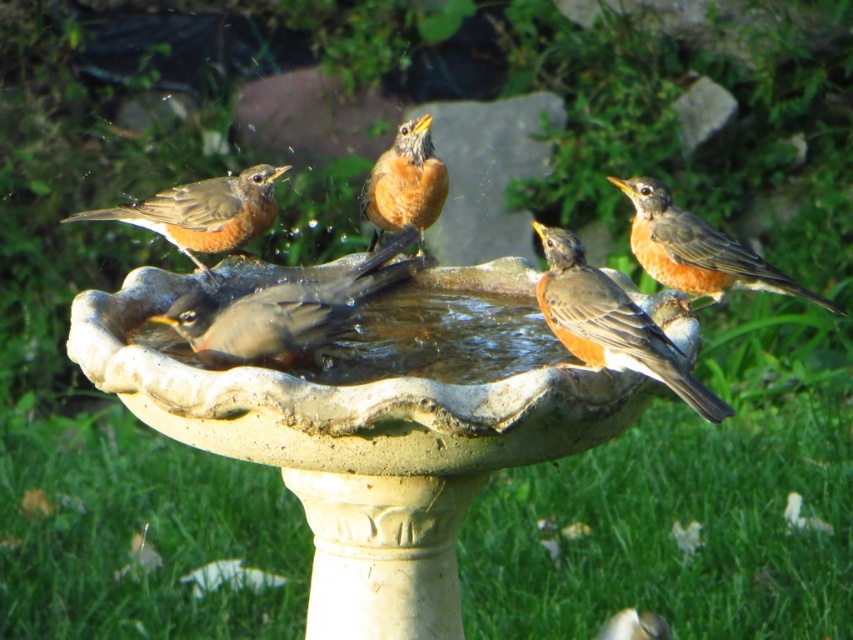
Between point (709, 282) and point (227, 193), which one is positioned in front?

Positioned in front is point (709, 282).

Between brown matte bird at right and brown matte bird at left, which one appears on the right side from the viewer's perspective?

From the viewer's perspective, brown matte bird at right appears more on the right side.

Who is more forward, [654,272] or [236,240]?

Positioned in front is point [236,240].

Locate an element on the screen. The height and width of the screenshot is (640, 853). brown matte bird at right is located at coordinates (695, 250).

Measure the distance between brown matte bird at center and camera.

A distance of 7.25 feet exists between brown matte bird at center and camera.

Does brown matte bird at center lie in front of brown matte bird at left?

Yes, it is.

Between point (339, 332) and point (236, 253), which one is positioned in front?

Point (339, 332) is in front.

Locate an element on the screen. The height and width of the screenshot is (640, 853). brown matte bird at center is located at coordinates (281, 314).

Which of these two, brown matte bird at center or bright orange bird at center, stands taller?

Standing taller between the two is bright orange bird at center.

Between brown matte bird at center and bright orange bird at center, which one has less height?

brown matte bird at center

Between point (227, 355) and point (373, 244), which one is positioned in front?

Positioned in front is point (227, 355).

The height and width of the screenshot is (640, 853). I want to click on brown matte bird at center, so click(x=281, y=314).